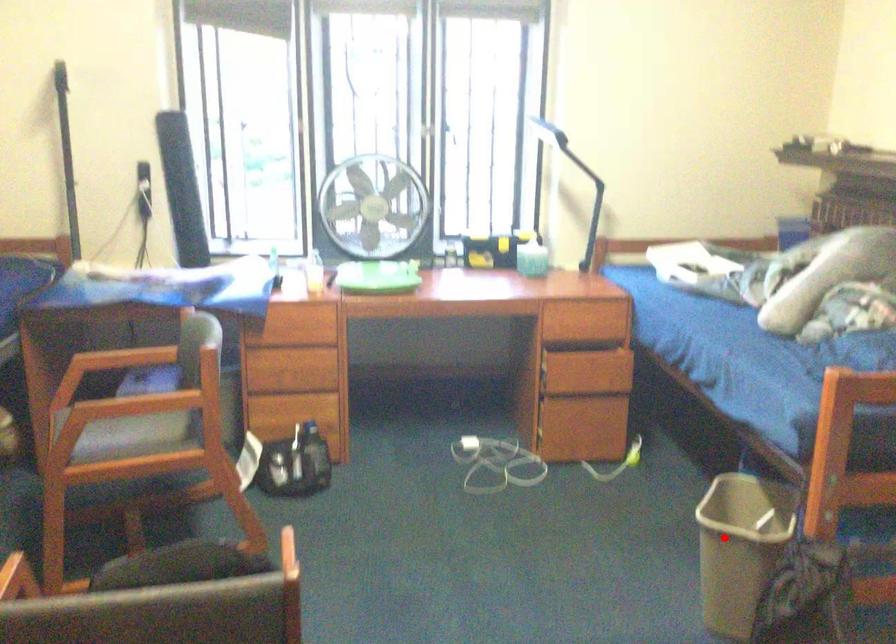
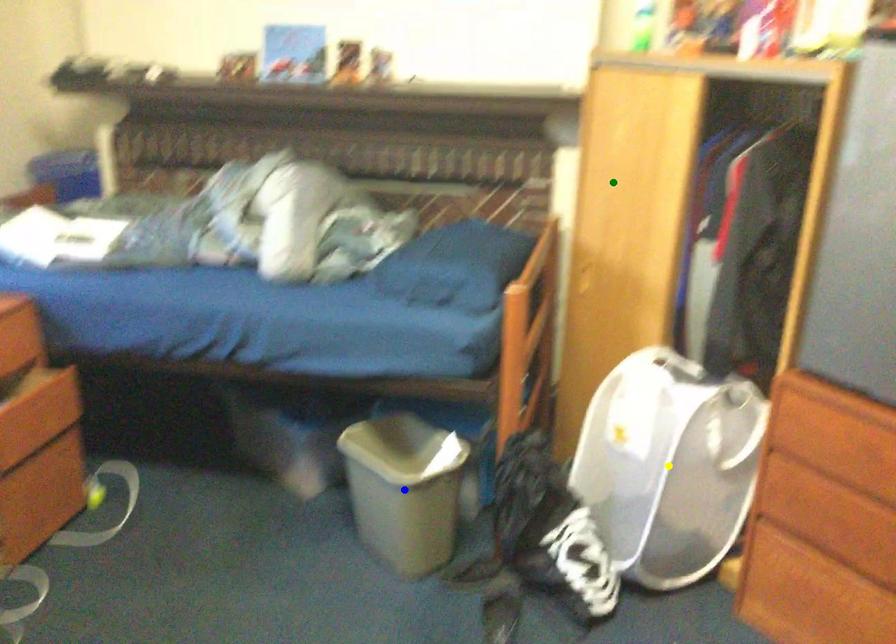
Question: I am providing you with two images of the same scene from different viewpoints. A red point is marked on the first image. You are given multiple points on the second image. Which point in image 2 is actually the same real-world point as the red point in image 1?

Choices:
 (A) yellow point
 (B) green point
 (C) blue point

Answer: (C)